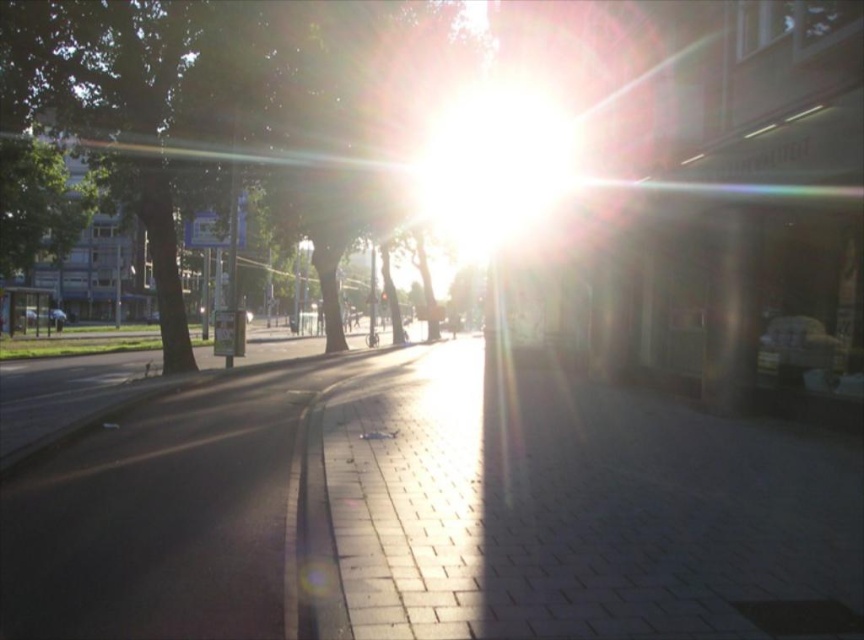
Question: Which object is closer to the camera taking this photo?

Choices:
 (A) green leafy tree at center
 (B) brick pavement at center

Answer: (B)

Question: Which of the following is the closest to the observer?

Choices:
 (A) (537, 440)
 (B) (422, 12)

Answer: (A)

Question: Is brick pavement at center below green leafy tree at center?

Choices:
 (A) yes
 (B) no

Answer: (A)

Question: Which point is farther to the camera?

Choices:
 (A) (620, 598)
 (B) (291, 4)

Answer: (B)

Question: Is brick pavement at center to the right of green leafy tree at center from the viewer's perspective?

Choices:
 (A) no
 (B) yes

Answer: (B)

Question: From the image, what is the correct spatial relationship of brick pavement at center in relation to green leafy tree at center?

Choices:
 (A) left
 (B) right

Answer: (B)